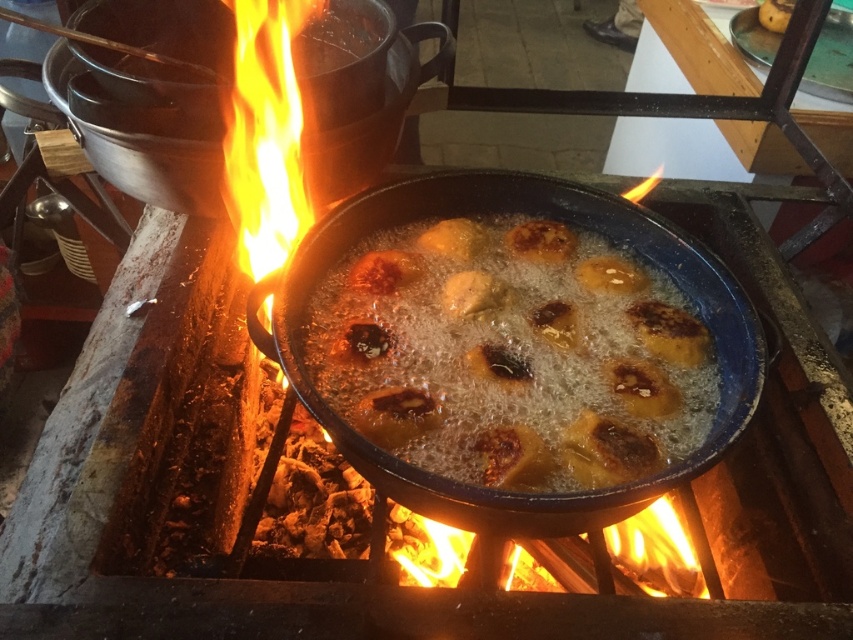
Who is more forward, (569, 444) or (379, 170)?

Point (569, 444) is more forward.

Identify the location of golden crispy pastry at center. This screenshot has height=640, width=853. (511, 355).

At what (x,y) coordinates should I click in order to perform the action: click on golden crispy pastry at center. Please return your answer as a coordinate pair (x, y). Looking at the image, I should click on (511, 355).